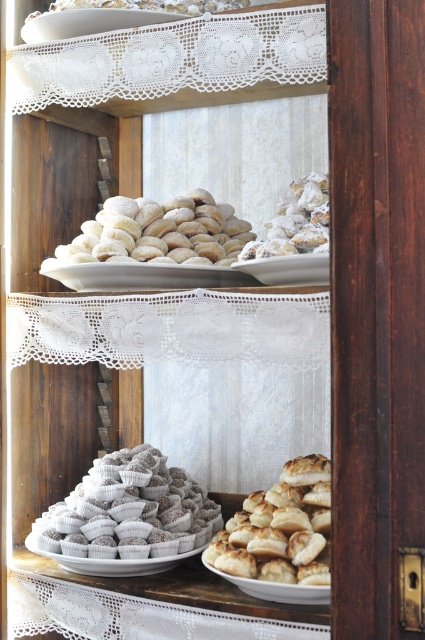
Question: Which object appears farthest from the camera in this image?

Choices:
 (A) white porcelain plate at center
 (B) white powdered sugar cookies at upper center
 (C) golden brown flaky pastry at lower center

Answer: (B)

Question: Which object is positioned farthest from the white paper cupcake at lower left?

Choices:
 (A) white porcelain plate at center
 (B) powdery white cookies at center

Answer: (B)

Question: Considering the relative positions of powdery white cookies at center and white powdered sugar cookies at upper center in the image provided, where is powdery white cookies at center located with respect to white powdered sugar cookies at upper center?

Choices:
 (A) below
 (B) above

Answer: (A)

Question: Can you confirm if golden brown flaky pastry at lower center is positioned to the right of white paper cupcake at lower left?

Choices:
 (A) no
 (B) yes

Answer: (B)

Question: Which object appears farthest from the camera in this image?

Choices:
 (A) powdery white pastry at center
 (B) white powdered sugar-coated pastries at center

Answer: (B)

Question: Is white powdered sugar-coated pastries at center wider than white paper cupcake at lower left?

Choices:
 (A) yes
 (B) no

Answer: (A)